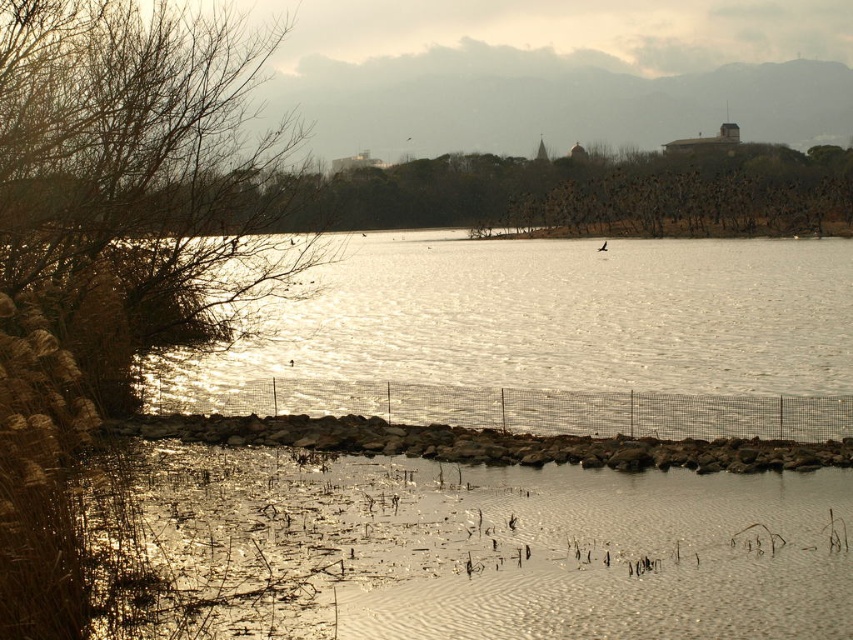
Question: Which of the following is the farthest from the observer?

Choices:
 (A) brown leafless branches at left
 (B) rusty stone wall at lower center

Answer: (B)

Question: Which point appears closest to the camera in this image?

Choices:
 (A) (251, 81)
 (B) (465, 429)
 (C) (775, 317)

Answer: (A)

Question: Considering the relative positions of glistening water at center and brown leafless branches at left in the image provided, where is glistening water at center located with respect to brown leafless branches at left?

Choices:
 (A) left
 (B) right

Answer: (B)

Question: Is brown leafless branches at left behind rusty stone wall at lower center?

Choices:
 (A) yes
 (B) no

Answer: (B)

Question: Which point is farther to the camera?

Choices:
 (A) (228, 76)
 (B) (532, 458)

Answer: (A)

Question: Is glistening water at center to the right of brown leafless branches at left from the viewer's perspective?

Choices:
 (A) no
 (B) yes

Answer: (B)